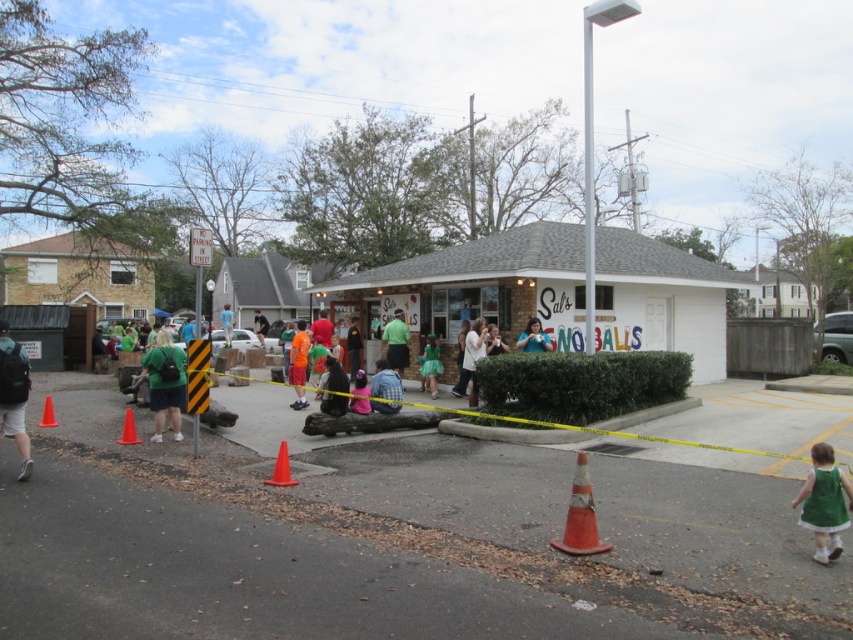
Question: Which object appears closest to the camera in this image?

Choices:
 (A) orange plastic traffic cone at lower center
 (B) green fabric shirt at center

Answer: (A)

Question: Can you confirm if green fabric shirt at center is bigger than orange fabric shirt at center?

Choices:
 (A) yes
 (B) no

Answer: (A)

Question: Can you confirm if green fabric shirt at center is smaller than orange fabric shirt at center?

Choices:
 (A) no
 (B) yes

Answer: (A)

Question: Which is nearer to the orange plastic traffic cone at lower center?

Choices:
 (A) orange matte traffic cone at lower left
 (B) plaid shirt at center

Answer: (B)

Question: Which is nearer to the orange fabric shirt at center?

Choices:
 (A) green satin dress at lower right
 (B) orange plastic traffic cone at lower center
 (C) orange reflective cone at lower center
 (D) white matte building at center

Answer: (D)

Question: Can you confirm if green matte shirt at center is smaller than green fabric shirt at center?

Choices:
 (A) no
 (B) yes

Answer: (B)